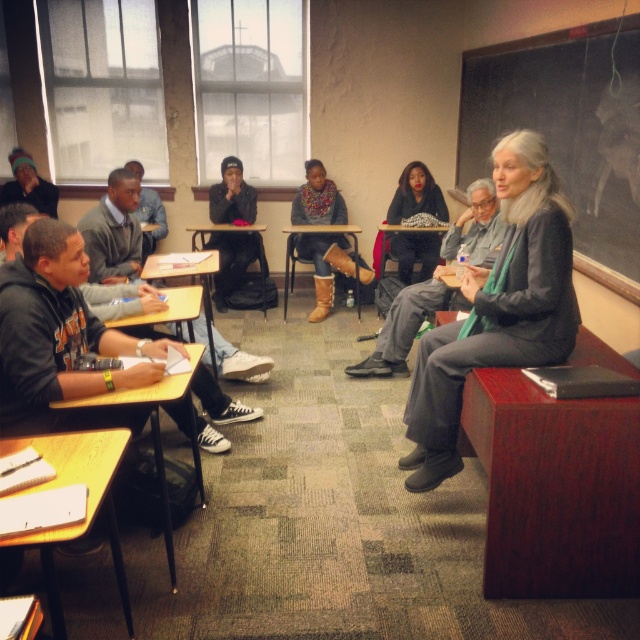
Looking at this image, you are standing in the classroom and want to determine the distance between the two points marked in the image. Which point is closer to you, point (64, 458) or point (387, 362)?

Point (64, 458) is closer to you than point (387, 362).